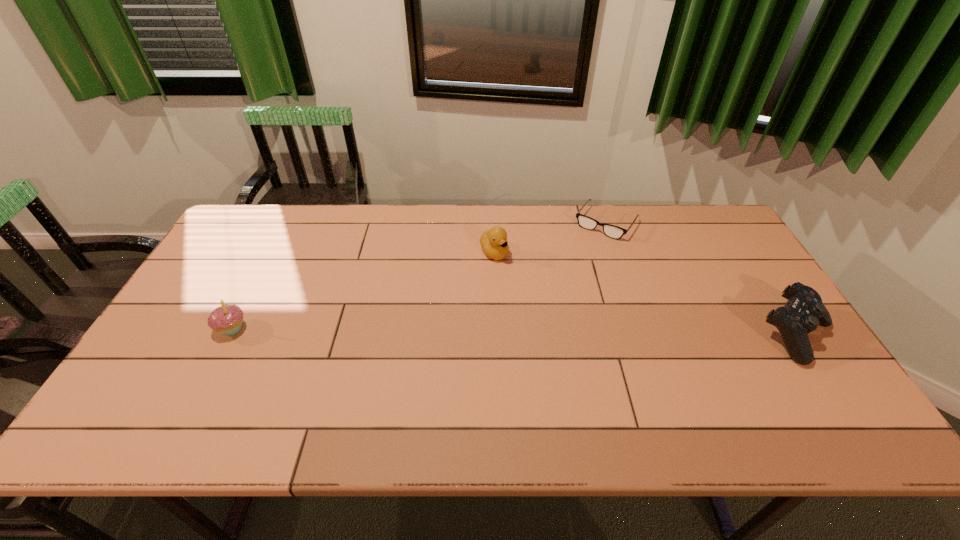
Identify the location of free space on the desktop that is between the leftmost object and the rightmost object and is positioned on the face of the second object from left to right. (563, 332).

This screenshot has width=960, height=540. I want to click on free spot on the desktop that is between the cupcake and the rightmost object and is positioned on the front-facing side of the shortest object, so click(x=528, y=332).